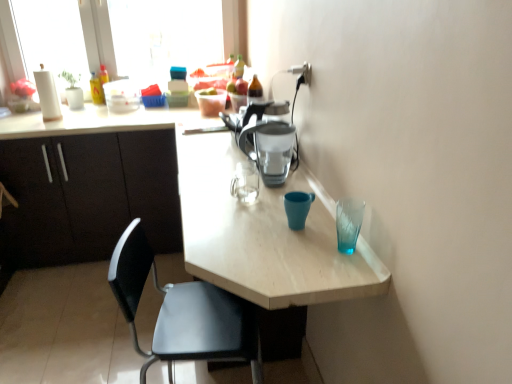
The height and width of the screenshot is (384, 512). I want to click on vacant space to the left of matte plastic coffee pot at center, so click(216, 184).